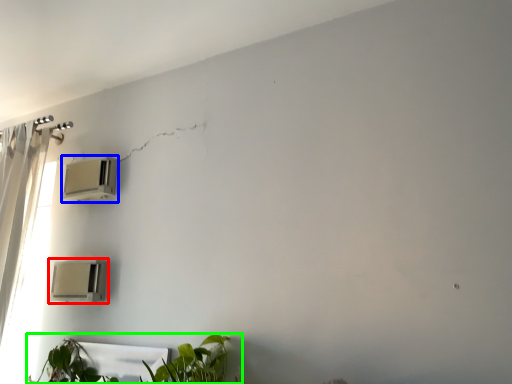
Question: Which is nearer to the air conditioning (highlighted by a red box)? air conditioning (highlighted by a blue box) or houseplant (highlighted by a green box).

Choices:
 (A) air conditioning
 (B) houseplant

Answer: (B)